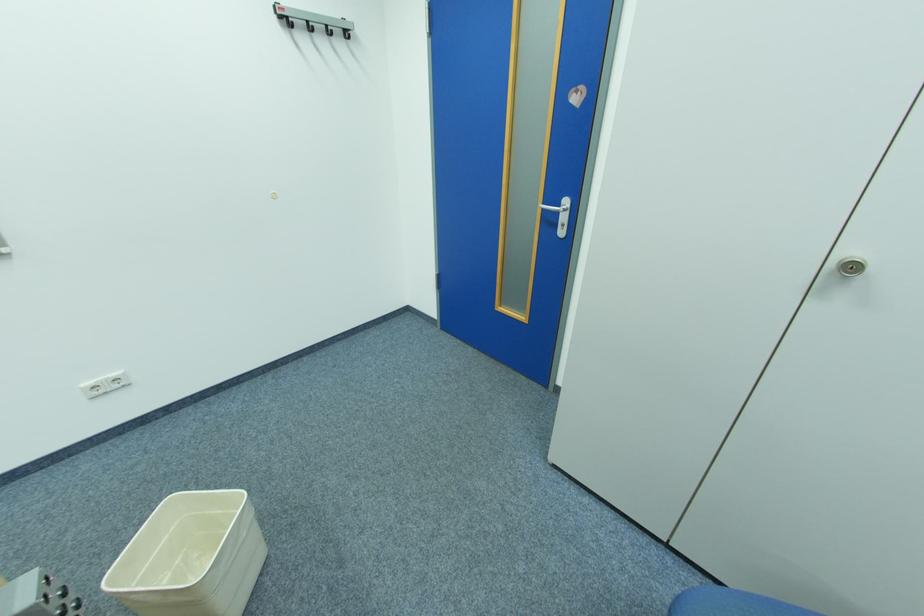
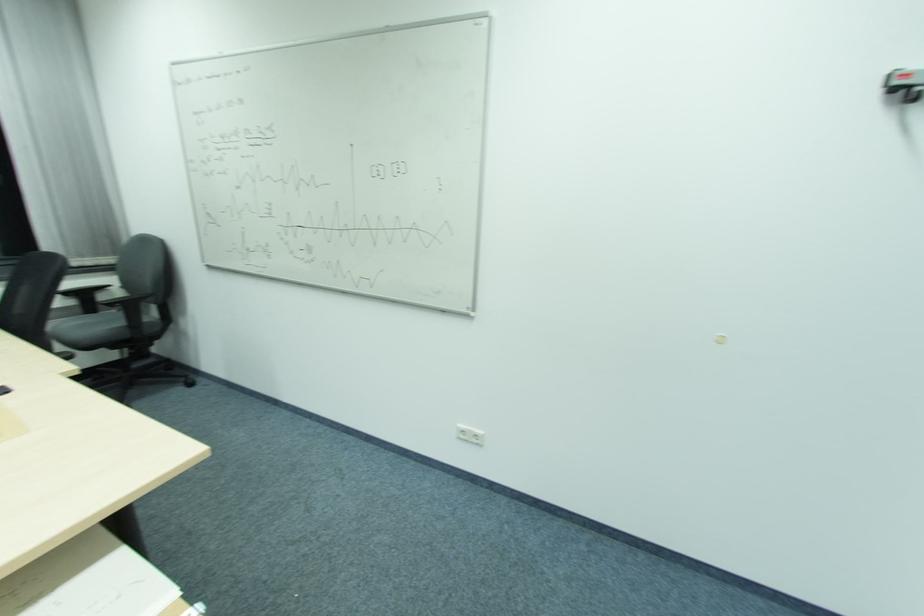
Question: Based on the continuous images, in which direction is the camera rotating? Reply with the corresponding letter.

Choices:
 (A) Left
 (B) Right
 (C) Up
 (D) Down

Answer: (A)